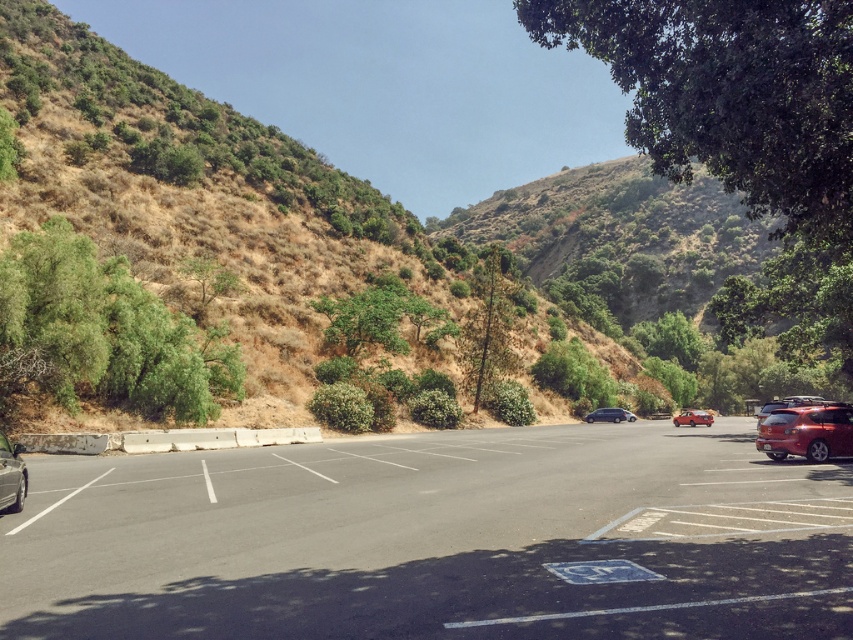
You are standing in the parking lot and want to park your car between the green leafy tree at left and the green textured tree at center. Is there enough space between them to park your car?

The green leafy tree at left is to the left of green textured tree at center, so there is space between them to park your car.

You are standing in the parking lot and want to take a photo of the green leafy tree at left. Which direction should you face to capture it in your camera view?

You should face towards the left side of the parking lot to capture the green leafy tree at left in your camera view since it is located at point (x=105, y=332) which is on the left side of the image.